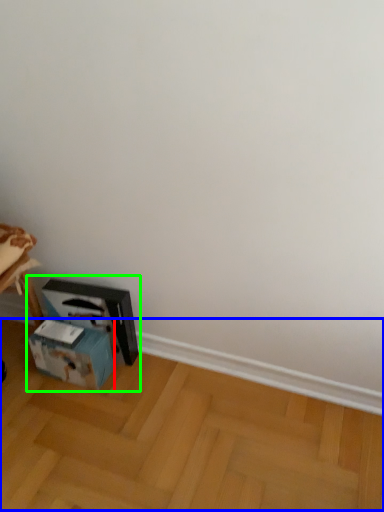
Question: Which is farther away from box (highlighted by a red box)? wood (highlighted by a blue box) or workbench (highlighted by a green box)?

Choices:
 (A) wood
 (B) workbench

Answer: (A)